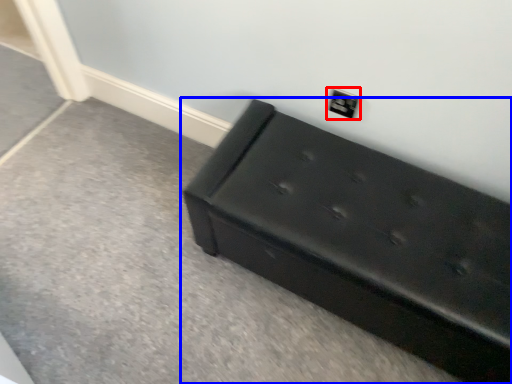
Question: Which object is further to the camera taking this photo, electric outlet (highlighted by a red box) or furniture (highlighted by a blue box)?

Choices:
 (A) electric outlet
 (B) furniture

Answer: (A)